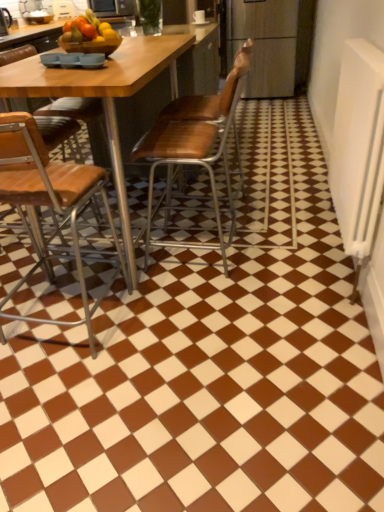
This screenshot has height=512, width=384. Find the location of `vacant space to the right of brown leather chair at left, acting as the third chair starting from the right`. vacant space to the right of brown leather chair at left, acting as the third chair starting from the right is located at coordinates (210, 336).